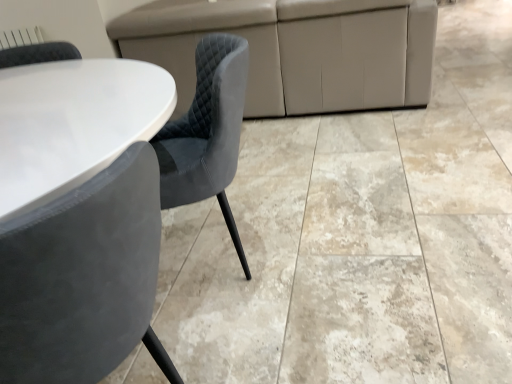
In order to face velvet grey chair at center, should I rotate leftwards or rightwards?

It's best to rotate left around 22.499 degrees.

What do you see at coordinates (83, 278) in the screenshot?
I see `velvet grey chair at center` at bounding box center [83, 278].

Where is `velvet grey chair at center`? This screenshot has width=512, height=384. velvet grey chair at center is located at coordinates (83, 278).

You are a GUI agent. You are given a task and a screenshot of the screen. Output one action in this format:
    pyautogui.click(x=<x>, y=<y>)
    Task: Click on the velvet grey chair at center
    
    Given the screenshot: What is the action you would take?
    pyautogui.click(x=83, y=278)